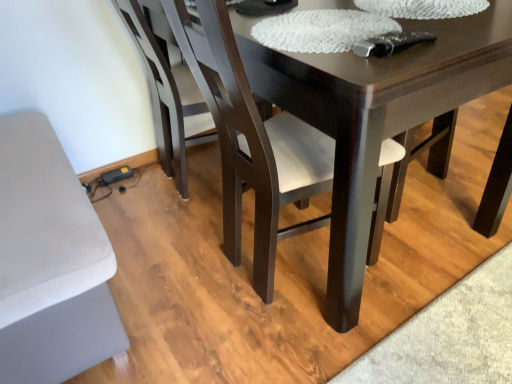
What do you see at coordinates (166, 96) in the screenshot? This screenshot has height=384, width=512. I see `dark wood chair at lower left, which ranks as the first chair in back-to-front order` at bounding box center [166, 96].

Find the location of a particular element. Image resolution: width=512 pixels, height=384 pixels. dark wood chair at lower left, which ranks as the first chair in back-to-front order is located at coordinates (166, 96).

What do you see at coordinates (254, 145) in the screenshot? I see `dark wood chair at center, positioned as the first chair in front-to-back order` at bounding box center [254, 145].

I want to click on dark wood chair at center, positioned as the second chair in back-to-front order, so click(254, 145).

Identify the location of dark wood chair at lower left, which ranks as the first chair in back-to-front order. The width and height of the screenshot is (512, 384). (166, 96).

Can you confirm if dark wood chair at center, positioned as the second chair in back-to-front order, is positioned to the right of dark wood chair at lower left, which ranks as the first chair in back-to-front order?

Indeed, dark wood chair at center, positioned as the second chair in back-to-front order, is positioned on the right side of dark wood chair at lower left, which ranks as the first chair in back-to-front order.

In the scene shown: Considering the positions of objects dark wood chair at center, positioned as the first chair in front-to-back order, and dark wood chair at lower left, the 2th chair when ordered from front to back, in the image provided, who is behind, dark wood chair at center, positioned as the first chair in front-to-back order, or dark wood chair at lower left, the 2th chair when ordered from front to back,?

dark wood chair at lower left, the 2th chair when ordered from front to back, is more distant.

Is point (242, 68) positioned behind point (189, 140)?

No, it is not.

From the image's perspective, is dark wood chair at center, positioned as the first chair in front-to-back order, located above or below dark wood chair at lower left, which ranks as the first chair in back-to-front order?

From the image's perspective, dark wood chair at center, positioned as the first chair in front-to-back order, appears below dark wood chair at lower left, which ranks as the first chair in back-to-front order.

From a real-world perspective, who is located lower, dark wood chair at center, positioned as the first chair in front-to-back order, or dark wood chair at lower left, which ranks as the first chair in back-to-front order?

dark wood chair at lower left, which ranks as the first chair in back-to-front order, is physically lower.

In terms of width, does dark wood chair at center, positioned as the first chair in front-to-back order, look wider or thinner when compared to dark wood chair at lower left, the 2th chair when ordered from front to back?

Considering their sizes, dark wood chair at center, positioned as the first chair in front-to-back order, looks broader than dark wood chair at lower left, the 2th chair when ordered from front to back.

Does dark wood chair at center, positioned as the first chair in front-to-back order, have a greater height compared to dark wood chair at lower left, which ranks as the first chair in back-to-front order?

Correct, dark wood chair at center, positioned as the first chair in front-to-back order, is much taller as dark wood chair at lower left, which ranks as the first chair in back-to-front order.

Is dark wood chair at center, positioned as the first chair in front-to-back order, bigger than dark wood chair at lower left, the 2th chair when ordered from front to back?

Correct, dark wood chair at center, positioned as the first chair in front-to-back order, is larger in size than dark wood chair at lower left, the 2th chair when ordered from front to back.

Is dark wood chair at center, positioned as the second chair in back-to-front order, completely or partially outside of dark wood chair at lower left, which ranks as the first chair in back-to-front order?

Yes, dark wood chair at center, positioned as the second chair in back-to-front order, is outside of dark wood chair at lower left, which ranks as the first chair in back-to-front order.

Is dark wood chair at center, positioned as the second chair in back-to-front order, far away from dark wood chair at lower left, which ranks as the first chair in back-to-front order?

No, there isn't a large distance between dark wood chair at center, positioned as the second chair in back-to-front order, and dark wood chair at lower left, which ranks as the first chair in back-to-front order.

Does dark wood chair at center, positioned as the second chair in back-to-front order, turn towards dark wood chair at lower left, which ranks as the first chair in back-to-front order?

No, dark wood chair at center, positioned as the second chair in back-to-front order, is not facing towards dark wood chair at lower left, which ranks as the first chair in back-to-front order.

Can you tell me how much dark wood chair at center, positioned as the second chair in back-to-front order, and dark wood chair at lower left, the 2th chair when ordered from front to back, differ in facing direction?

The angular difference between dark wood chair at center, positioned as the second chair in back-to-front order, and dark wood chair at lower left, the 2th chair when ordered from front to back, is 1.3 degrees.

How much distance is there between dark wood chair at center, positioned as the first chair in front-to-back order, and dark wood chair at lower left, the 2th chair when ordered from front to back?

dark wood chair at center, positioned as the first chair in front-to-back order, and dark wood chair at lower left, the 2th chair when ordered from front to back, are 21.28 inches apart.

What are the coordinates of `chair above the dark wood chair at center, positioned as the second chair in back-to-front order (from the image's perspective)` in the screenshot? It's located at (166, 96).

Is dark wood chair at lower left, which ranks as the first chair in back-to-front order, to the left of dark wood chair at center, positioned as the second chair in back-to-front order, from the viewer's perspective?

Yes.

Is dark wood chair at lower left, the 2th chair when ordered from front to back, further to the viewer compared to dark wood chair at center, positioned as the second chair in back-to-front order?

Yes, the depth of dark wood chair at lower left, the 2th chair when ordered from front to back, is greater than that of dark wood chair at center, positioned as the second chair in back-to-front order.

Is point (177, 73) in front of point (254, 166)?

No.

In the scene shown: From the image's perspective, is dark wood chair at lower left, which ranks as the first chair in back-to-front order, below dark wood chair at center, positioned as the second chair in back-to-front order?

No.

From a real-world perspective, is dark wood chair at lower left, which ranks as the first chair in back-to-front order, positioned over dark wood chair at center, positioned as the first chair in front-to-back order, based on gravity?

Incorrect, from a real-world perspective, dark wood chair at lower left, which ranks as the first chair in back-to-front order, is lower than dark wood chair at center, positioned as the first chair in front-to-back order.

Considering the sizes of objects dark wood chair at lower left, which ranks as the first chair in back-to-front order, and dark wood chair at center, positioned as the first chair in front-to-back order, in the image provided, who is wider, dark wood chair at lower left, which ranks as the first chair in back-to-front order, or dark wood chair at center, positioned as the first chair in front-to-back order,?

dark wood chair at center, positioned as the first chair in front-to-back order, is wider.

Which of these two, dark wood chair at lower left, which ranks as the first chair in back-to-front order, or dark wood chair at center, positioned as the first chair in front-to-back order, stands shorter?

dark wood chair at lower left, which ranks as the first chair in back-to-front order.

Between dark wood chair at lower left, the 2th chair when ordered from front to back, and dark wood chair at center, positioned as the first chair in front-to-back order, which one has larger size?

Bigger between the two is dark wood chair at center, positioned as the first chair in front-to-back order.

Is dark wood chair at lower left, the 2th chair when ordered from front to back, surrounding dark wood chair at center, positioned as the first chair in front-to-back order?

No.

Is the surface of dark wood chair at lower left, the 2th chair when ordered from front to back, in direct contact with dark wood chair at center, positioned as the first chair in front-to-back order?

No, dark wood chair at lower left, the 2th chair when ordered from front to back, is not next to dark wood chair at center, positioned as the first chair in front-to-back order.

Is dark wood chair at lower left, which ranks as the first chair in back-to-front order, oriented away from dark wood chair at center, positioned as the second chair in back-to-front order?

That's not correct — dark wood chair at lower left, which ranks as the first chair in back-to-front order, is not looking away from dark wood chair at center, positioned as the second chair in back-to-front order.

Identify the location of chair in front of the dark wood chair at lower left, which ranks as the first chair in back-to-front order. This screenshot has height=384, width=512. (254, 145).

Where is `chair below the dark wood chair at lower left, the 2th chair when ordered from front to back (from the image's perspective)`? This screenshot has height=384, width=512. chair below the dark wood chair at lower left, the 2th chair when ordered from front to back (from the image's perspective) is located at coordinates (254, 145).

Image resolution: width=512 pixels, height=384 pixels. Identify the location of chair behind the dark wood chair at center, positioned as the first chair in front-to-back order. 166,96.